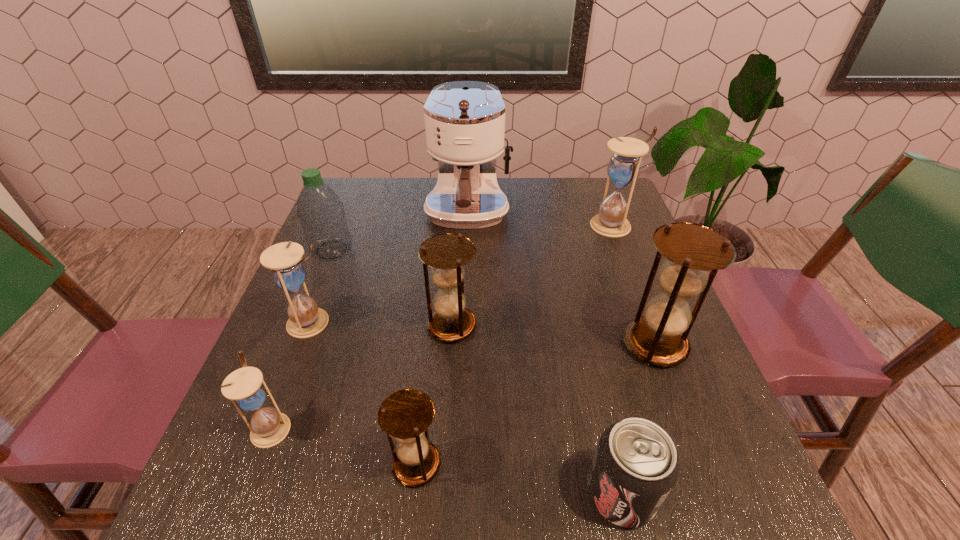
Locate an element on the screen. This screenshot has height=540, width=960. vacant point at the near edge is located at coordinates (475, 534).

The height and width of the screenshot is (540, 960). What are the coordinates of `free space at the left edge of the desktop` in the screenshot? It's located at (317, 366).

In the image, there is a desktop. What are the coordinates of `vacant space at the right edge` in the screenshot? It's located at (614, 288).

Where is `vacant space at the far left corner of the desktop`? The image size is (960, 540). vacant space at the far left corner of the desktop is located at coordinates (380, 180).

The height and width of the screenshot is (540, 960). In the image, there is a desktop. What are the coordinates of `free space at the near left corner` in the screenshot? It's located at (200, 510).

In order to click on vacant area at the near right corner of the desktop in this screenshot , I will do `click(736, 478)`.

Locate an element on the screen. The image size is (960, 540). free space between the soda can and the second biggest white hourglass is located at coordinates (467, 408).

You are a GUI agent. You are given a task and a screenshot of the screen. Output one action in this format:
    pyautogui.click(x=<x>, y=<y>)
    Task: Click on the vacant space in between the green water bottle and the coffee maker
    
    Given the screenshot: What is the action you would take?
    pyautogui.click(x=399, y=232)

The height and width of the screenshot is (540, 960). In order to click on unoccupied position between the second nearest white hourglass and the second smallest brown hourglass in this screenshot , I will do [382, 324].

Identify the location of vacant area that lies between the coffee maker and the second farthest white hourglass. (390, 268).